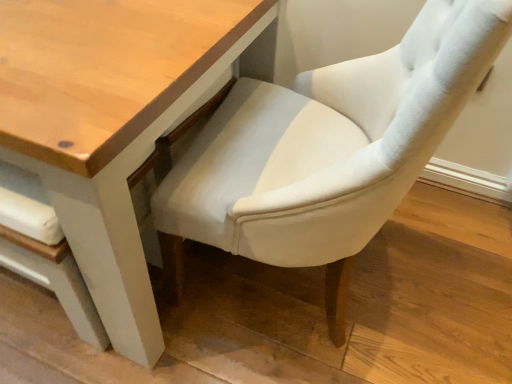
Image resolution: width=512 pixels, height=384 pixels. In order to click on wooden table at center in this screenshot , I will do tap(110, 124).

Describe the element at coordinates (110, 124) in the screenshot. I see `wooden table at center` at that location.

Identify the location of light gray fabric chair at center. (327, 150).

This screenshot has height=384, width=512. What do you see at coordinates (327, 150) in the screenshot?
I see `light gray fabric chair at center` at bounding box center [327, 150].

What is the approximate width of light gray fabric chair at center?

23.52 inches.

From the picture: What is the approximate height of light gray fabric chair at center?

The height of light gray fabric chair at center is 96.04 centimeters.

Locate an element on the screen. This screenshot has width=512, height=384. wooden table at center is located at coordinates (110, 124).

Based on their positions, is wooden table at center located to the left or right of light gray fabric chair at center?

wooden table at center is to the left of light gray fabric chair at center.

Is the depth of wooden table at center less than that of light gray fabric chair at center?

No, wooden table at center is further to the viewer.

Is point (10, 43) in front of point (369, 227)?

Yes, it is.

From the image's perspective, is wooden table at center located beneath light gray fabric chair at center?

Incorrect, from the image's perspective, wooden table at center is higher than light gray fabric chair at center.

From a real-world perspective, which is physically above, wooden table at center or light gray fabric chair at center?

light gray fabric chair at center.

Considering the relative sizes of wooden table at center and light gray fabric chair at center in the image provided, is wooden table at center thinner than light gray fabric chair at center?

No, wooden table at center is not thinner than light gray fabric chair at center.

Looking at this image, considering the relative sizes of wooden table at center and light gray fabric chair at center in the image provided, is wooden table at center shorter than light gray fabric chair at center?

Yes.

Between wooden table at center and light gray fabric chair at center, which one has larger size?

wooden table at center is bigger.

Is light gray fabric chair at center completely or partially inside wooden table at center?

No, light gray fabric chair at center is located outside of wooden table at center.

Are wooden table at center and light gray fabric chair at center located far from each other?

No, there isn't a large distance between wooden table at center and light gray fabric chair at center.

Is wooden table at center turned away from light gray fabric chair at center?

No, wooden table at center is not facing away from light gray fabric chair at center.

Can you tell me how much wooden table at center and light gray fabric chair at center differ in facing direction?

The facing directions of wooden table at center and light gray fabric chair at center are 88.1 degrees apart.

How distant is wooden table at center from light gray fabric chair at center?

The distance of wooden table at center from light gray fabric chair at center is 10.92 inches.

This screenshot has height=384, width=512. I want to click on chair that is in front of the wooden table at center, so click(327, 150).

Is light gray fabric chair at center to the right of wooden table at center from the viewer's perspective?

Indeed, light gray fabric chair at center is positioned on the right side of wooden table at center.

Is light gray fabric chair at center closer to camera compared to wooden table at center?

Yes, it is in front of wooden table at center.

Between point (370, 192) and point (125, 278), which one is positioned in front?

The point (370, 192) is in front.

From the image's perspective, is light gray fabric chair at center above or below wooden table at center?

Clearly, from the image's perspective, light gray fabric chair at center is below wooden table at center.

From a real-world perspective, who is located higher, light gray fabric chair at center or wooden table at center?

From a 3D spatial view, light gray fabric chair at center is above.

Which object is wider, light gray fabric chair at center or wooden table at center?

wooden table at center is wider.

Which of these two, light gray fabric chair at center or wooden table at center, stands taller?

light gray fabric chair at center is taller.

Does light gray fabric chair at center have a smaller size compared to wooden table at center?

Indeed, light gray fabric chair at center has a smaller size compared to wooden table at center.

Based on the photo, is light gray fabric chair at center surrounding wooden table at center?

No, wooden table at center is not surrounded by light gray fabric chair at center.

Consider the image. Are light gray fabric chair at center and wooden table at center far apart?

No, there isn't a large distance between light gray fabric chair at center and wooden table at center.

Is light gray fabric chair at center aimed at wooden table at center?

Yes, light gray fabric chair at center faces towards wooden table at center.

How much distance is there between light gray fabric chair at center and wooden table at center?

The distance of light gray fabric chair at center from wooden table at center is 10.92 inches.

Where is `table that appears on the left of light gray fabric chair at center`? The height and width of the screenshot is (384, 512). table that appears on the left of light gray fabric chair at center is located at coordinates click(x=110, y=124).

You are a GUI agent. You are given a task and a screenshot of the screen. Output one action in this format:
    pyautogui.click(x=<x>, y=<y>)
    Task: Click on the table on the left of the light gray fabric chair at center
    The width and height of the screenshot is (512, 384).
    Given the screenshot: What is the action you would take?
    pyautogui.click(x=110, y=124)

Where is `chair above the wooden table at center (from a real-world perspective)`? chair above the wooden table at center (from a real-world perspective) is located at coordinates (327, 150).